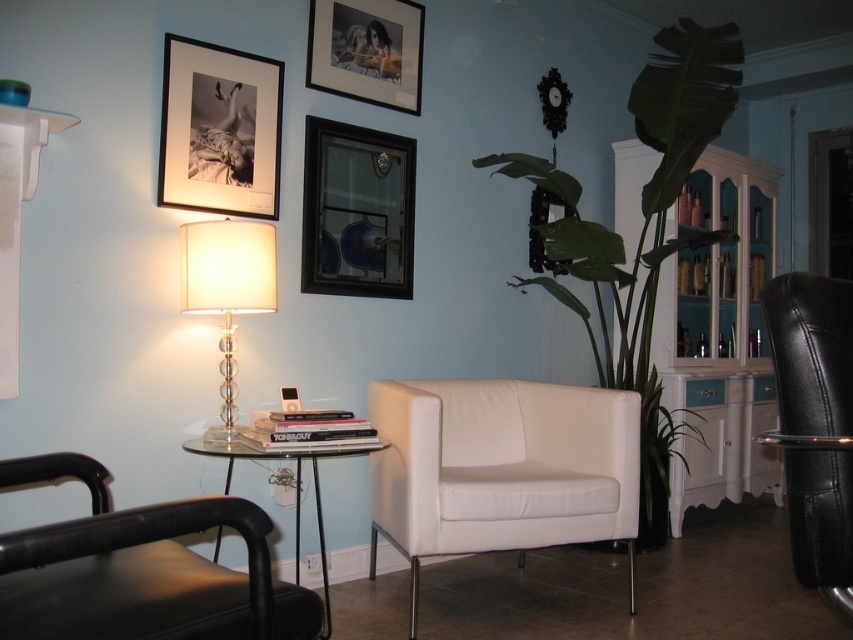
You are standing in the room and want to reach the point at coordinates point (378,465) from the point (204,225). Is the destination point behind or in front of your starting position?

The point (378,465) is behind the point (204,225), so the destination is behind your starting position.

You are standing in the room and want to reach the matte black picture frame at upper left. The room has a door 10 feet away from you. Can you reach the frame before reaching the door?

The matte black picture frame at upper left is only 8.05 feet away from you, which is closer than the door that is 10 feet away. Therefore, you can reach the frame before reaching the door.